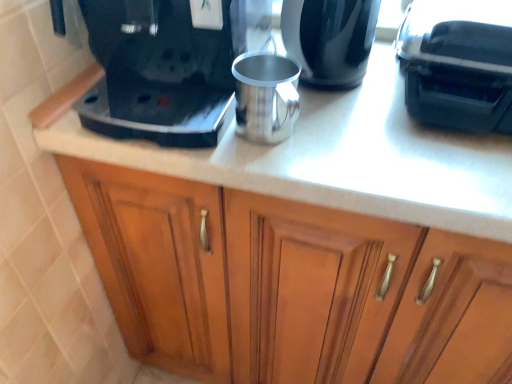
The image size is (512, 384). I want to click on free space on the front side of shiny black kettle at upper center, so click(361, 144).